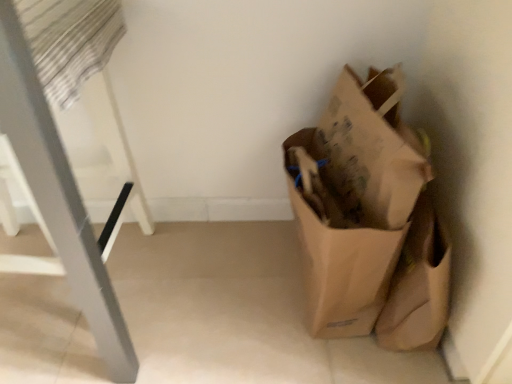
I want to click on vacant area situated below metallic silver ladder at left (from a real-world perspective), so click(36, 286).